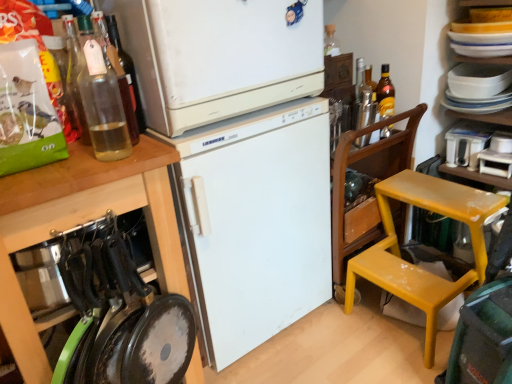
Identify the location of free spot in front of translucent glass bottle at upper left, the second bottle from the left. (112, 157).